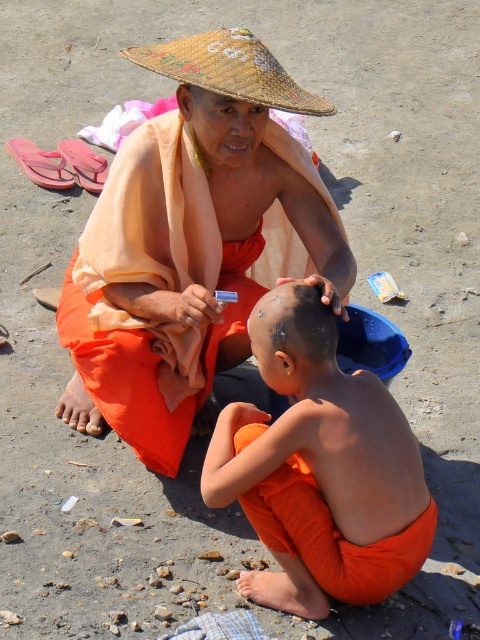
Question: Does orange cloth monk at center have a lesser width compared to orange matte cloth at lower center?

Choices:
 (A) no
 (B) yes

Answer: (A)

Question: Which of the following is the closest to the observer?

Choices:
 (A) black matte hair at center
 (B) woven straw hat at upper center

Answer: (A)

Question: Is orange cloth monk at center below black matte hair at center?

Choices:
 (A) no
 (B) yes

Answer: (A)

Question: Does orange matte cloth at lower center lie in front of woven straw hat at upper center?

Choices:
 (A) yes
 (B) no

Answer: (A)

Question: Considering the real-world distances, which object is farthest from the black matte hair at center?

Choices:
 (A) woven straw hat at upper center
 (B) orange cloth monk at center
 (C) orange matte cloth at lower center

Answer: (A)

Question: Which point is closer to the camera?

Choices:
 (A) orange matte cloth at lower center
 (B) orange cloth monk at center
 (C) black matte hair at center

Answer: (C)